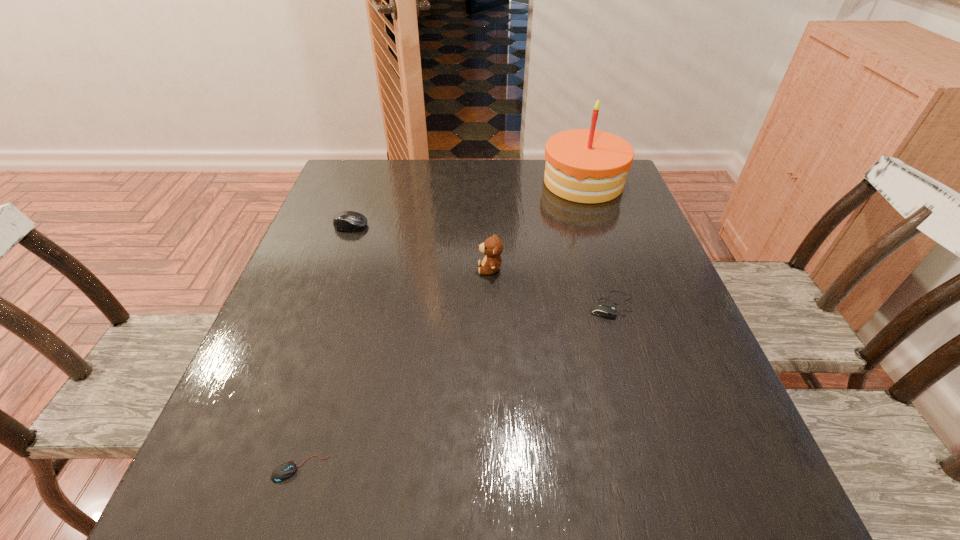
Locate an element on the screen. The height and width of the screenshot is (540, 960). free spot that satisfies the following two spatial constraints: 1. on the front side of the third tallest object; 2. on the left side of the shortest mouse is located at coordinates click(x=264, y=469).

You are a GUI agent. You are given a task and a screenshot of the screen. Output one action in this format:
    pyautogui.click(x=<x>, y=<y>)
    Task: Click on the blank space that satisfies the following two spatial constraints: 1. on the face of the teddy bear; 2. on the left side of the second nearest mouse
    Image resolution: width=960 pixels, height=540 pixels.
    Given the screenshot: What is the action you would take?
    pyautogui.click(x=491, y=305)

The width and height of the screenshot is (960, 540). I want to click on free point that satisfies the following two spatial constraints: 1. on the face of the third farthest object; 2. on the front side of the nearest mouse, so click(x=495, y=469).

Locate an element on the screen. The width and height of the screenshot is (960, 540). free space that satisfies the following two spatial constraints: 1. on the face of the teddy bear; 2. on the front side of the shortest object is located at coordinates (495, 469).

Where is `free space that satisfies the following two spatial constraints: 1. on the face of the second tallest object; 2. on the right side of the fourth tallest object`? free space that satisfies the following two spatial constraints: 1. on the face of the second tallest object; 2. on the right side of the fourth tallest object is located at coordinates (491, 305).

This screenshot has height=540, width=960. Find the location of `free location that satisfies the following two spatial constraints: 1. on the face of the third farthest object; 2. on the front side of the shortest mouse`. free location that satisfies the following two spatial constraints: 1. on the face of the third farthest object; 2. on the front side of the shortest mouse is located at coordinates (495, 469).

Where is `free space that satisfies the following two spatial constraints: 1. on the face of the fourth tallest object; 2. on the right side of the teddy bear`? free space that satisfies the following two spatial constraints: 1. on the face of the fourth tallest object; 2. on the right side of the teddy bear is located at coordinates (491, 305).